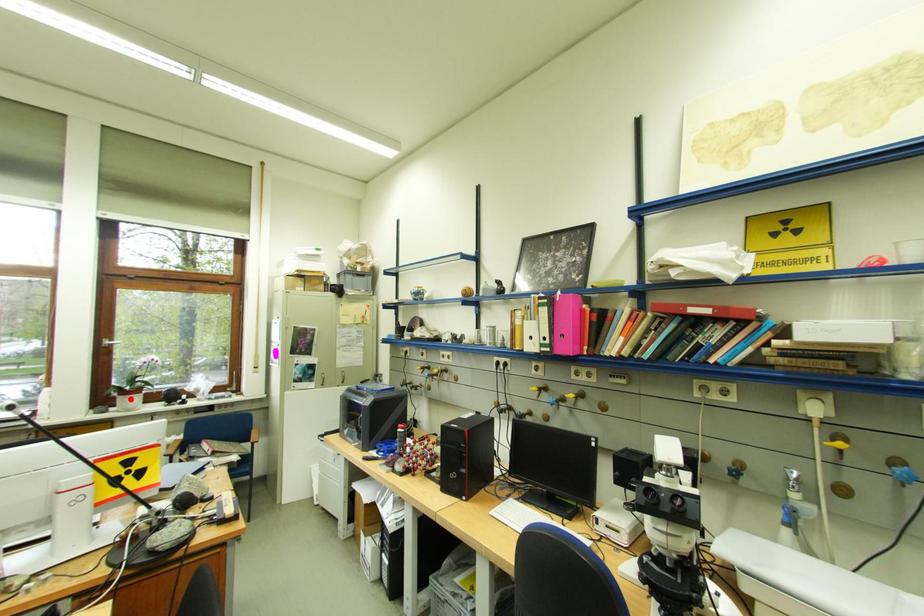
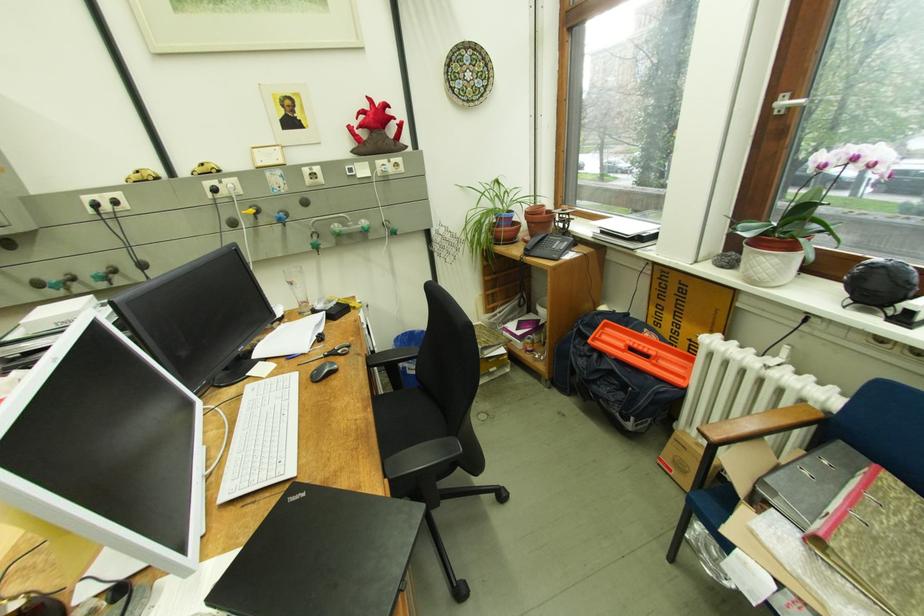
The point at the highlighted location is marked in the first image. Where is the corresponding point in the second image?

(758, 249)